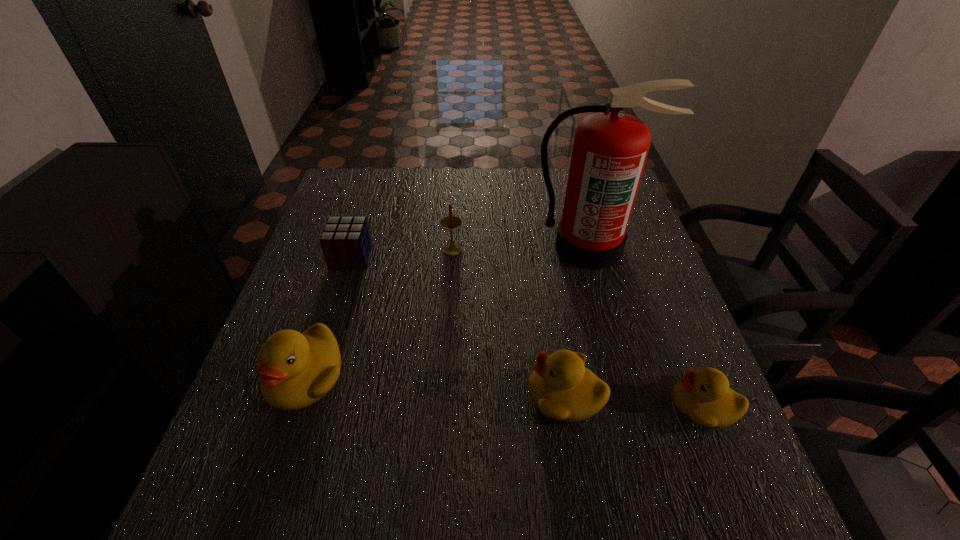
Identify the location of free spot between the second shortest duckling and the leftmost duckling. This screenshot has width=960, height=540. (435, 385).

Where is `vacant space that is in between the third shortest object and the fire extinguisher`? The width and height of the screenshot is (960, 540). vacant space that is in between the third shortest object and the fire extinguisher is located at coordinates (578, 321).

Locate an element on the screen. Image resolution: width=960 pixels, height=540 pixels. empty space that is in between the cube and the second duckling from left to right is located at coordinates (459, 326).

The height and width of the screenshot is (540, 960). I want to click on free spot between the tallest object and the third shortest object, so click(578, 321).

At what (x,y) coordinates should I click in order to perform the action: click on free spot between the fire extinguisher and the leftmost duckling. Please return your answer as a coordinate pair (x, y). The width and height of the screenshot is (960, 540). Looking at the image, I should click on (447, 311).

Image resolution: width=960 pixels, height=540 pixels. In order to click on free space between the tallest object and the third shortest object in this screenshot , I will do 578,321.

The width and height of the screenshot is (960, 540). I want to click on free spot between the cube and the fourth tallest object, so click(x=459, y=326).

Locate an element on the screen. vacant space that is in between the rightmost duckling and the leftmost duckling is located at coordinates (504, 390).

Identify the location of object that ranks as the fifth closest to the leftmost duckling. (703, 397).

Identify the location of object that is the fifth closest one to the second shortest duckling. The image size is (960, 540). click(x=345, y=241).